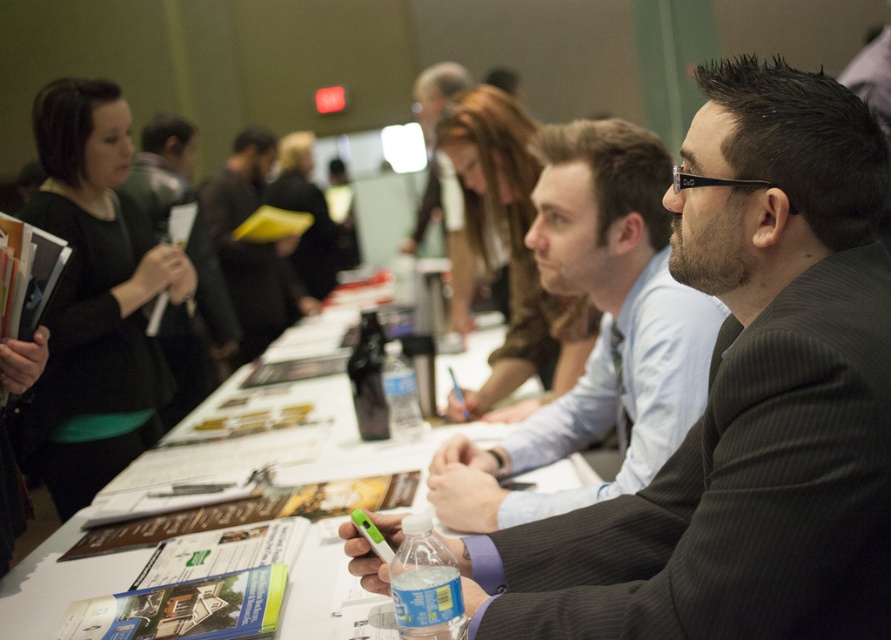
Question: Which object is positioned closest to the white paper at center?

Choices:
 (A) black suit at center
 (B) matte black suit at center

Answer: (B)

Question: Does black suit at center have a smaller size compared to clear plastic bottle at center?

Choices:
 (A) yes
 (B) no

Answer: (B)

Question: Where is black suit at center located in relation to clear plastic bottle at center in the image?

Choices:
 (A) below
 (B) above

Answer: (A)

Question: Does matte black jacket at center have a larger size compared to clear plastic water bottle at center?

Choices:
 (A) no
 (B) yes

Answer: (B)

Question: Based on their relative distances, which object is nearer to the matte black suit at center?

Choices:
 (A) black suit at center
 (B) matte black jacket at center
 (C) translucent plastic water bottle at center
 (D) clear plastic bottle at center

Answer: (A)

Question: Which point is closer to the camera?

Choices:
 (A) clear plastic bottle at center
 (B) matte black suit at center
 (C) matte black jacket at center
 (D) translucent plastic water bottle at center

Answer: (D)